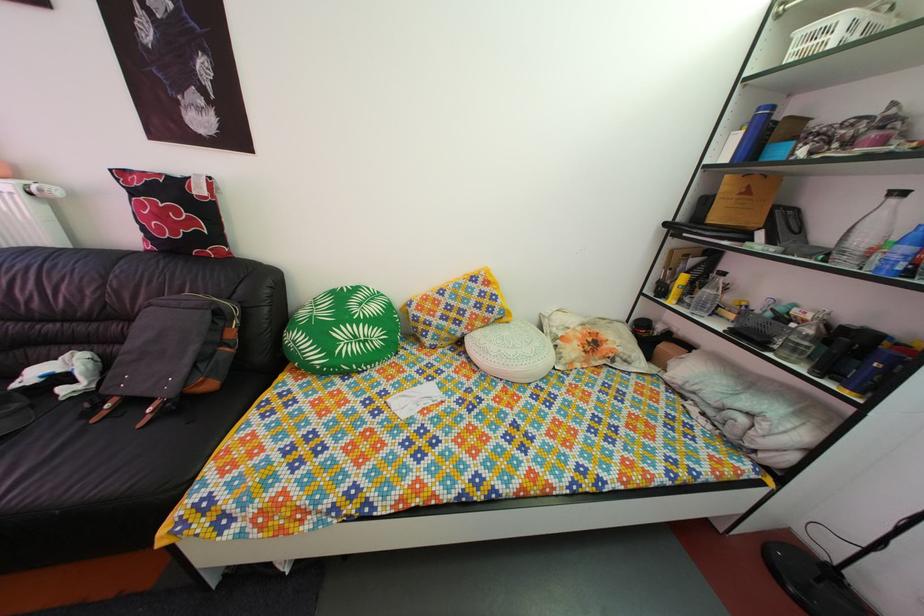
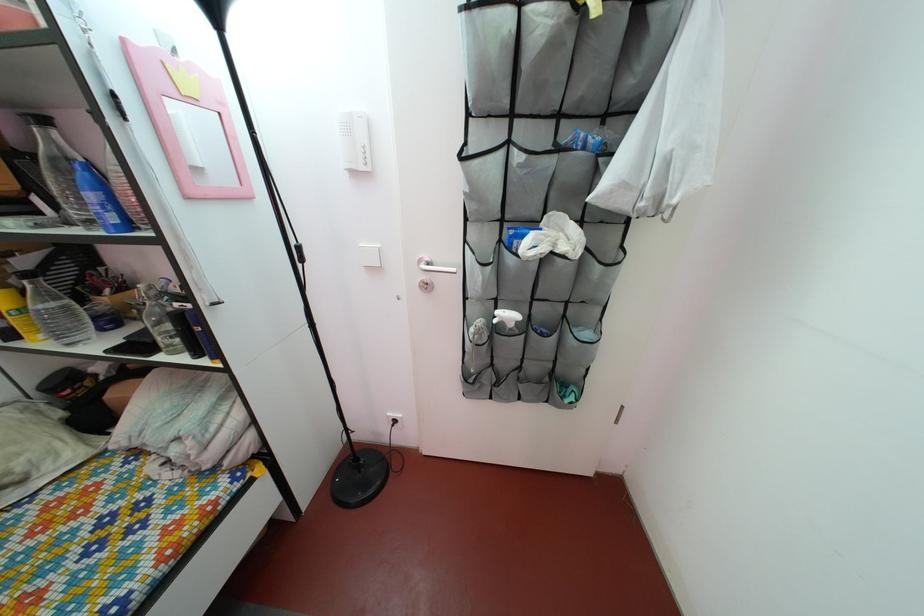
In the second image, find the point that corresponds to (701,270) in the first image.

(32, 270)